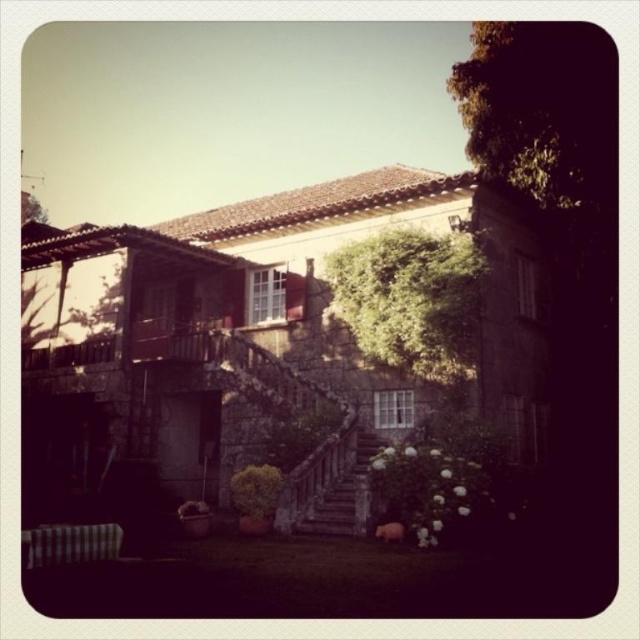
Question: Is stone textured stairs at center closer to camera compared to rustic stone stairs at center?

Choices:
 (A) yes
 (B) no

Answer: (B)

Question: Among these objects, which one is farthest from the camera?

Choices:
 (A) stone textured stairs at center
 (B) rustic stone stairs at center

Answer: (A)

Question: Among these objects, which one is farthest from the camera?

Choices:
 (A) stone textured stairs at center
 (B) rustic stone stairs at center

Answer: (A)

Question: Does stone textured stairs at center have a lesser width compared to rustic stone stairs at center?

Choices:
 (A) no
 (B) yes

Answer: (A)

Question: Which object appears closest to the camera in this image?

Choices:
 (A) stone textured stairs at center
 (B) rustic stone stairs at center

Answer: (B)

Question: Does stone textured stairs at center appear on the left side of rustic stone stairs at center?

Choices:
 (A) no
 (B) yes

Answer: (B)